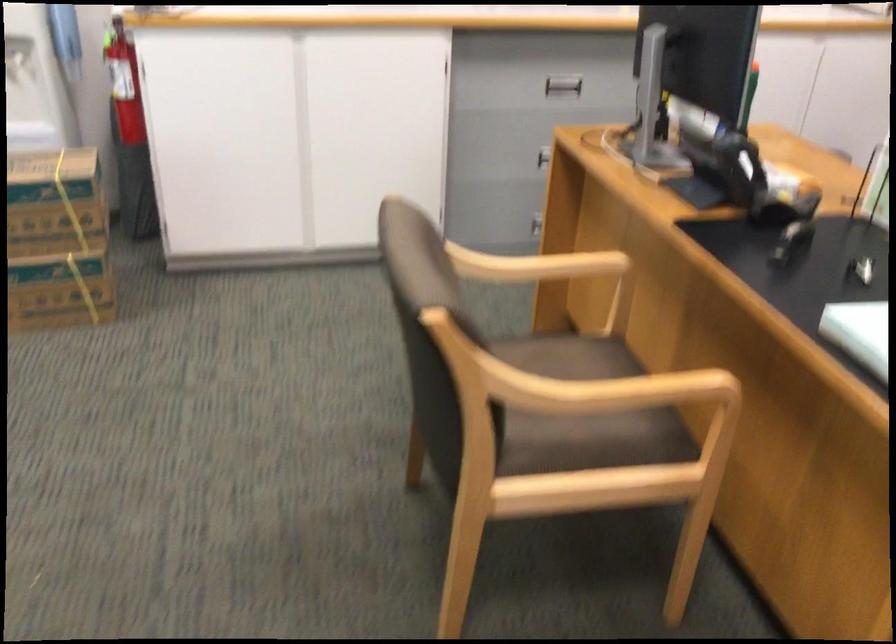
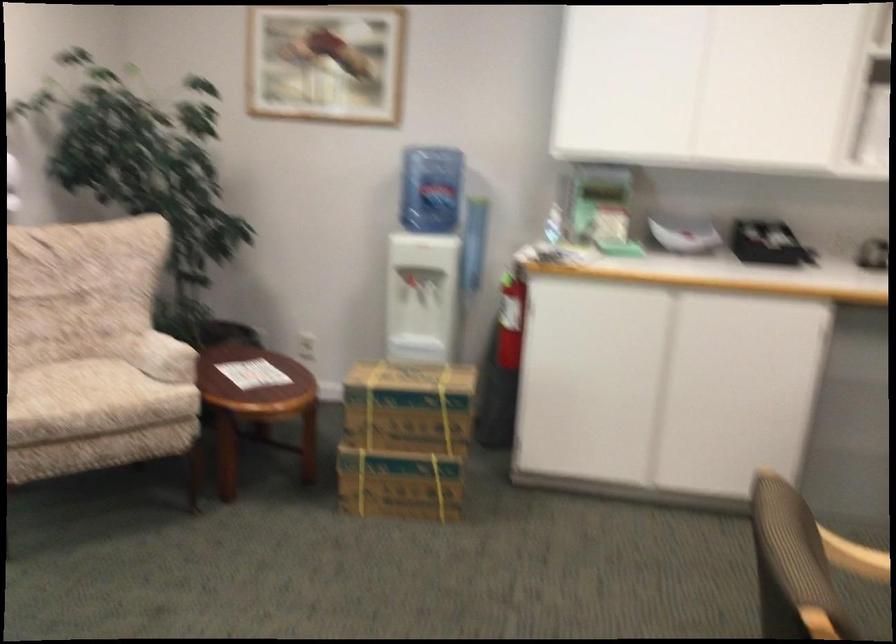
Where in the second image is the point corresponding to (125,104) from the first image?

(510, 321)